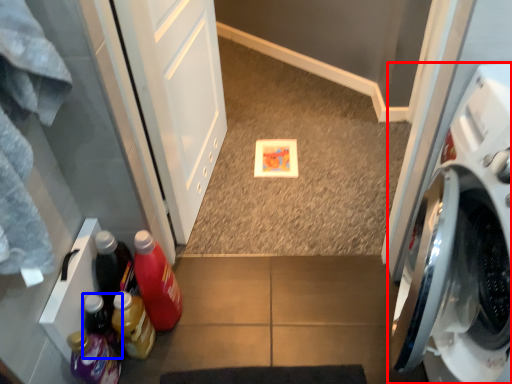
Question: Among these objects, which one is farthest to the camera, washing machine (highlighted by a red box) or bottle (highlighted by a blue box)?

Choices:
 (A) washing machine
 (B) bottle

Answer: (B)